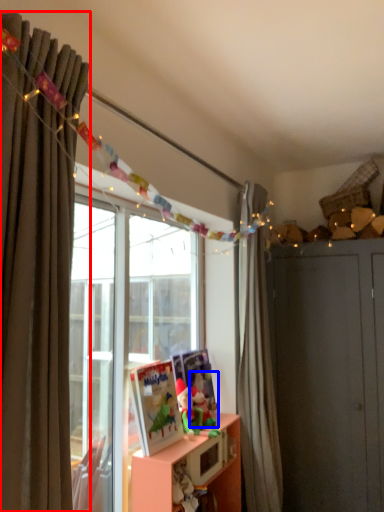
Question: Which of the following is the closest to the observer, curtain (highlighted by a red box) or toy (highlighted by a blue box)?

Choices:
 (A) curtain
 (B) toy

Answer: (A)